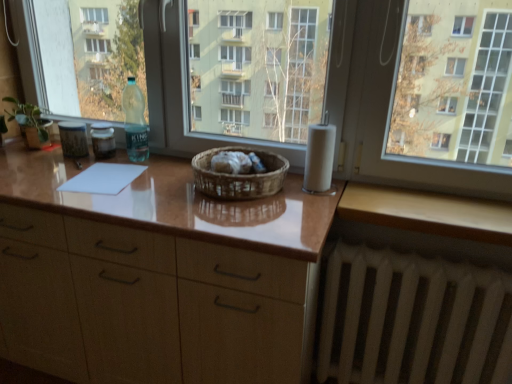
The width and height of the screenshot is (512, 384). Identify the location of vacant position to the left of woven brown basket at center. (151, 188).